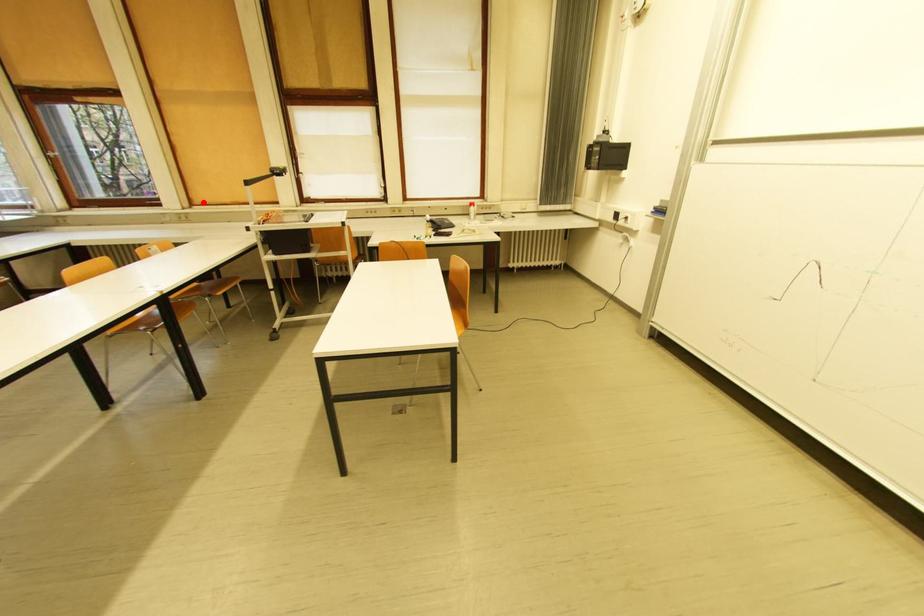
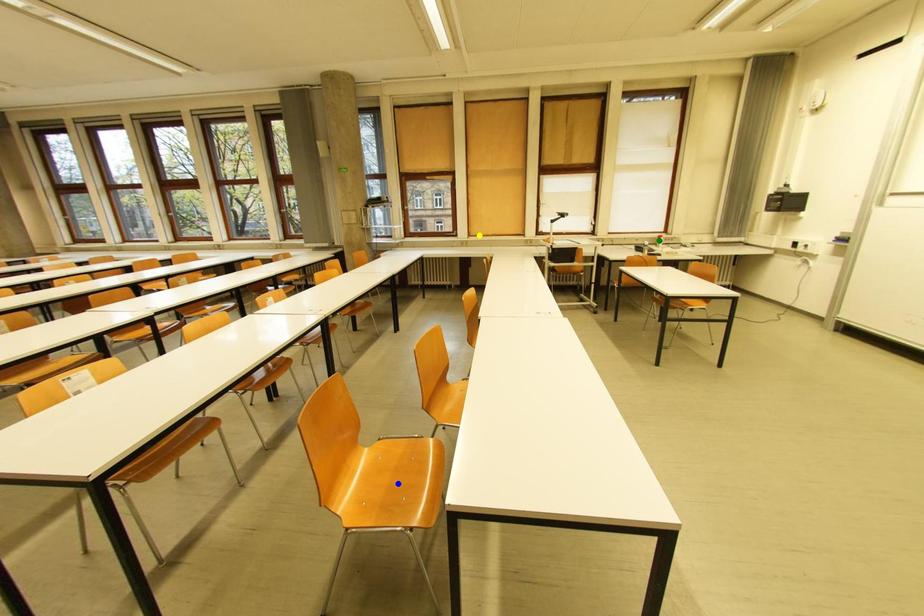
Question: I am providing you with two images of the same scene from different viewpoints. A red point is marked on the first image. You are given multiple points on the second image. Which point in image 2 represents the same 3d spot as the red point in image 1?

Choices:
 (A) yellow point
 (B) blue point
 (C) green point

Answer: (A)